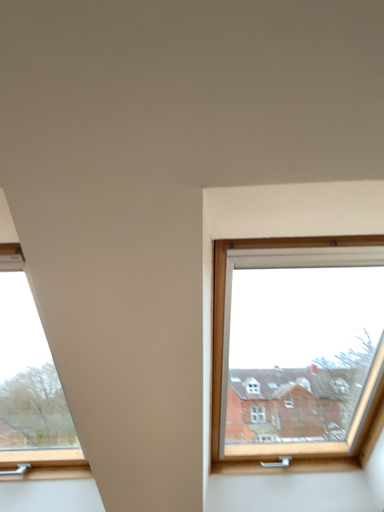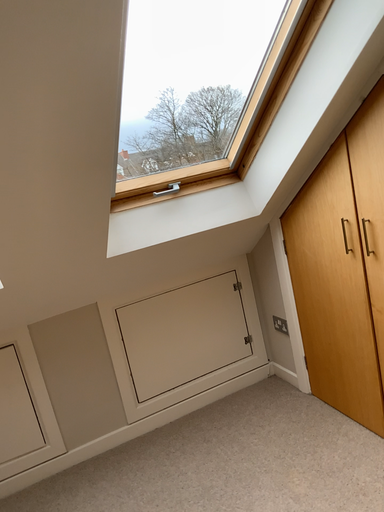
Question: How did the camera likely rotate when shooting the video?

Choices:
 (A) rotated upward
 (B) rotated downward

Answer: (B)